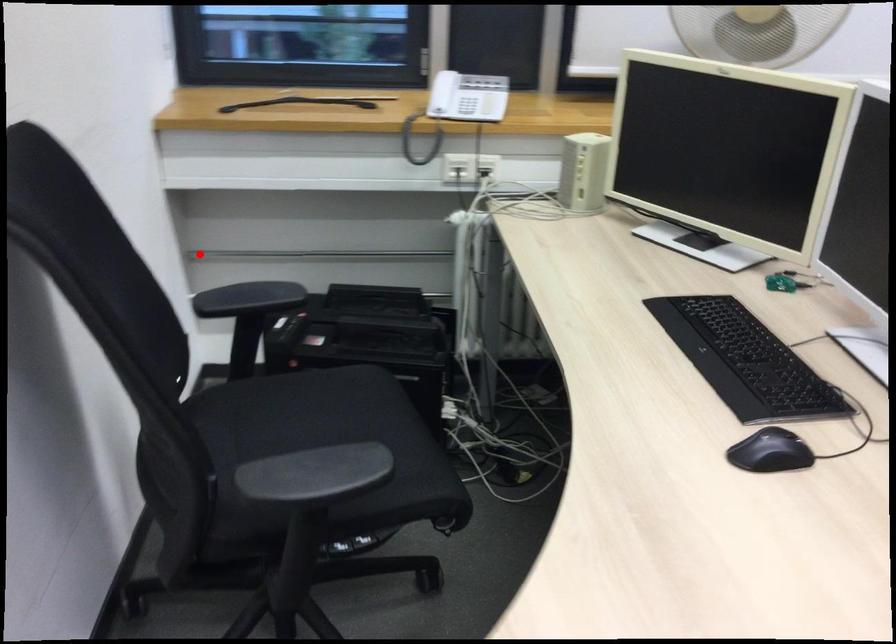
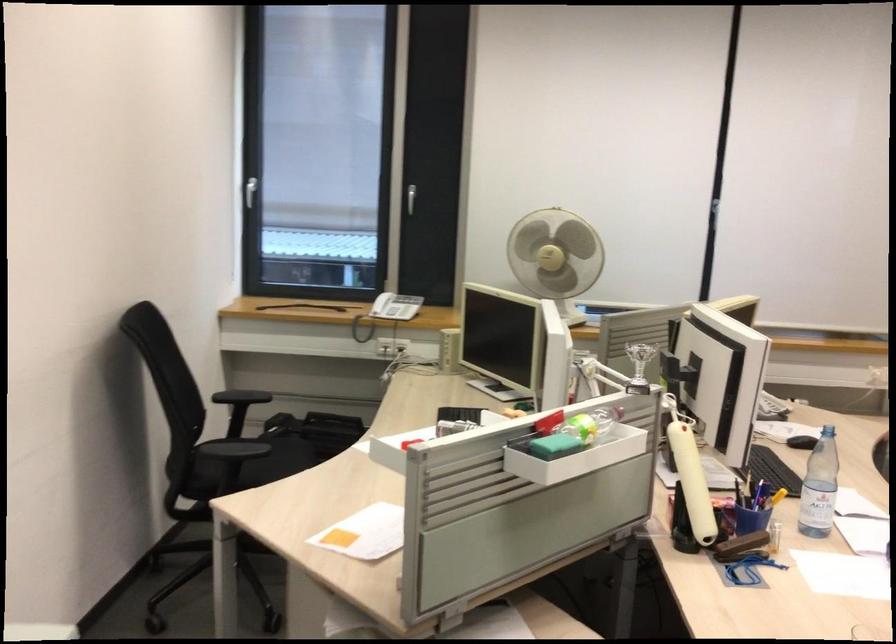
Question: I am providing you with two images of the same scene from different viewpoints. A red point is shown in image1. For the corresponding object point in image2, is it positioned nearer or farther from the camera?

Choices:
 (A) Nearer
 (B) Farther

Answer: (B)